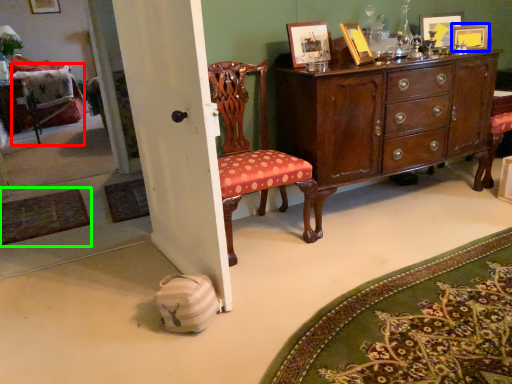
Question: Based on their relative distances, which object is farther from swivel chair (highlighted by a red box)? Choose from picture frame (highlighted by a blue box) and mat (highlighted by a green box).

Choices:
 (A) picture frame
 (B) mat

Answer: (A)